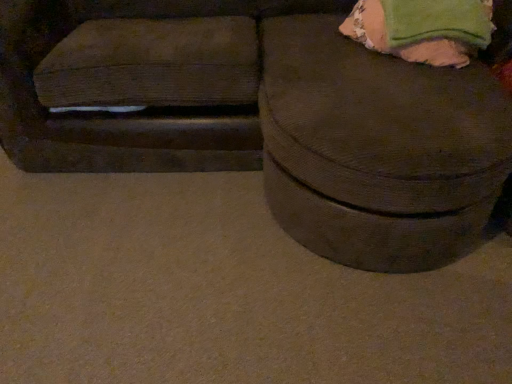
Question: Does brown corduroy ottoman at center turn towards green fabric bean bag at upper right?

Choices:
 (A) yes
 (B) no

Answer: (A)

Question: Does brown corduroy ottoman at center have a smaller size compared to green fabric bean bag at upper right?

Choices:
 (A) yes
 (B) no

Answer: (B)

Question: Can you confirm if brown corduroy ottoman at center is positioned to the left of green fabric bean bag at upper right?

Choices:
 (A) yes
 (B) no

Answer: (A)

Question: Is brown corduroy ottoman at center with green fabric bean bag at upper right?

Choices:
 (A) no
 (B) yes

Answer: (A)

Question: From a real-world perspective, is brown corduroy ottoman at center positioned under green fabric bean bag at upper right based on gravity?

Choices:
 (A) no
 (B) yes

Answer: (B)

Question: Does brown corduroy ottoman at center have a lesser width compared to green fabric bean bag at upper right?

Choices:
 (A) yes
 (B) no

Answer: (B)

Question: Is brown corduroy ottoman at center surrounded by green fabric bean bag at upper right?

Choices:
 (A) yes
 (B) no

Answer: (B)

Question: Does green fabric bean bag at upper right have a greater height compared to brown corduroy ottoman at center?

Choices:
 (A) no
 (B) yes

Answer: (A)

Question: Does green fabric bean bag at upper right appear on the right side of brown corduroy ottoman at center?

Choices:
 (A) yes
 (B) no

Answer: (A)

Question: From a real-world perspective, is green fabric bean bag at upper right positioned over brown corduroy ottoman at center based on gravity?

Choices:
 (A) no
 (B) yes

Answer: (B)

Question: From the image's perspective, is green fabric bean bag at upper right above brown corduroy ottoman at center?

Choices:
 (A) no
 (B) yes

Answer: (B)

Question: Is green fabric bean bag at upper right positioned in front of brown corduroy ottoman at center?

Choices:
 (A) yes
 (B) no

Answer: (B)

Question: From the image's perspective, is brown corduroy ottoman at center positioned above or below green fabric bean bag at upper right?

Choices:
 (A) below
 (B) above

Answer: (A)